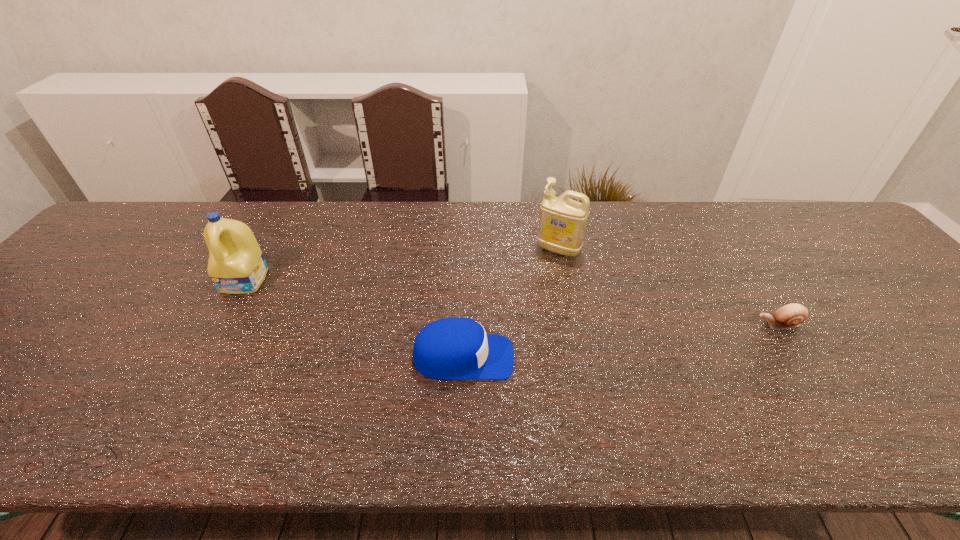
The height and width of the screenshot is (540, 960). Find the location of `the farthest object`. the farthest object is located at coordinates point(562,223).

Identify the location of the right detergent. The image size is (960, 540). 562,223.

Locate an element on the screen. This screenshot has height=540, width=960. the second farthest object is located at coordinates (236, 265).

Where is `the leftmost object`? The height and width of the screenshot is (540, 960). the leftmost object is located at coordinates (236, 265).

Identify the location of the nearest object. (455, 348).

Identify the location of baseball cap. This screenshot has height=540, width=960. (455, 348).

Locate an element on the screen. the rightmost object is located at coordinates (789, 316).

Image resolution: width=960 pixels, height=540 pixels. What are the coordinates of `the shortest object` in the screenshot? It's located at (789, 316).

The image size is (960, 540). In order to click on vacant region located on the front of the right detergent in this screenshot , I will do `click(567, 291)`.

At what (x,y) coordinates should I click in order to perform the action: click on free location located 0.360m on the label of the third nearest object. Please return your answer as a coordinate pair (x, y). Looking at the image, I should click on (163, 427).